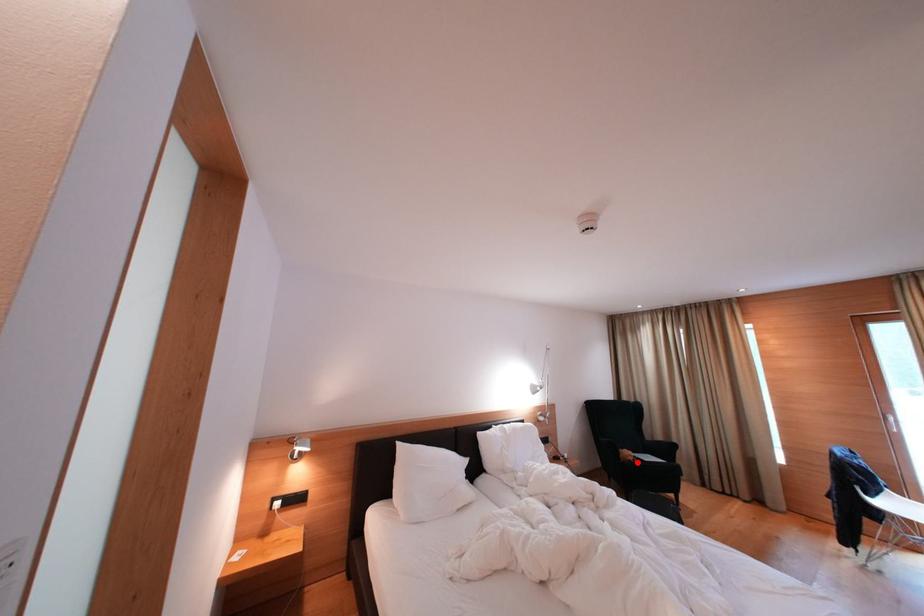
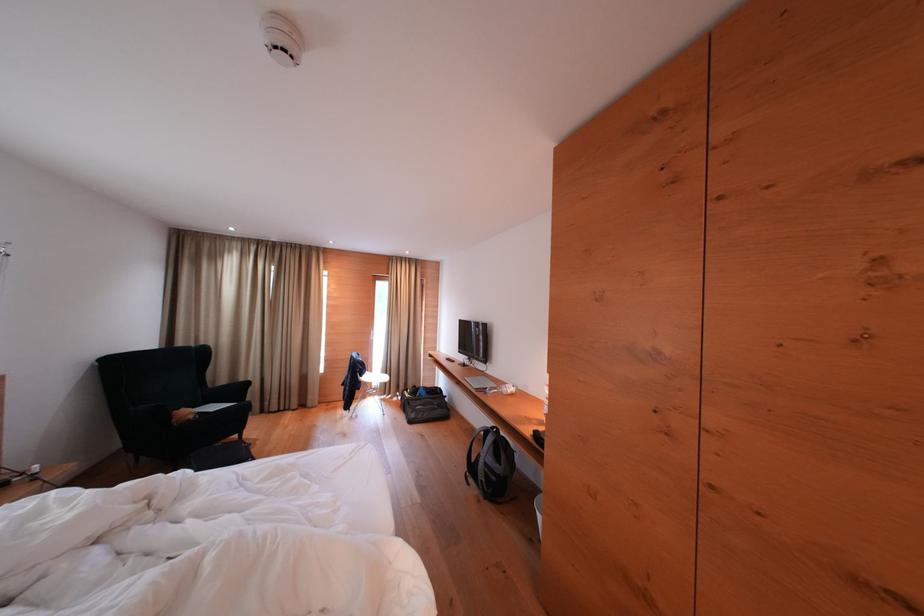
Question: I am providing you with two images of the same scene from different viewpoints. Image1 has a red point marked. In image2, the corresponding 3D location appears at what relative position? Reply with the corresponding letter.

Choices:
 (A) Closer
 (B) Farther

Answer: (A)